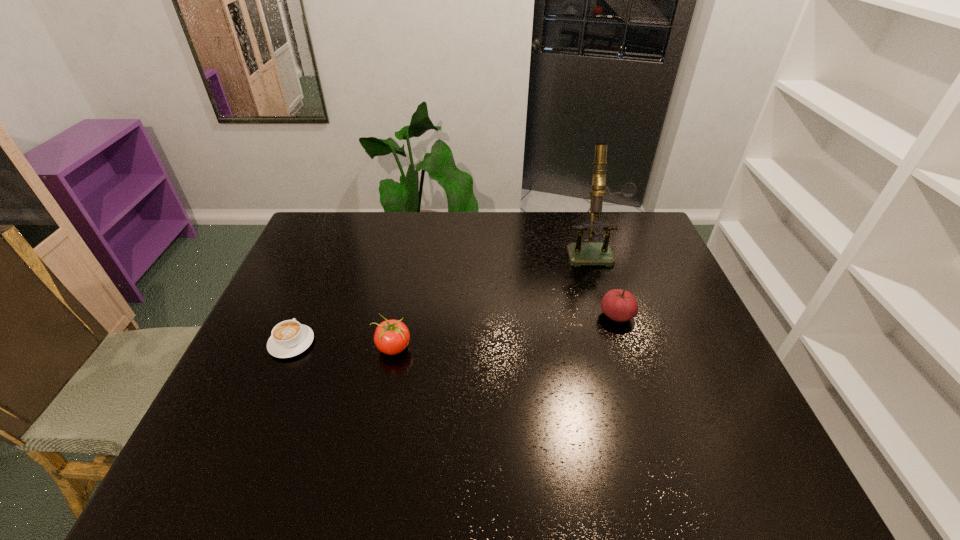
Where is `microscope`? microscope is located at coordinates (579, 253).

Where is `the farthest object`? the farthest object is located at coordinates (579, 253).

Where is `the farther tomato`? the farther tomato is located at coordinates pos(619,305).

In order to click on the second object from left to right in this screenshot , I will do `click(391, 337)`.

In order to click on the nearer tomato in this screenshot , I will do `click(391, 337)`.

Locate an element on the screen. This screenshot has width=960, height=540. the leftmost object is located at coordinates (289, 338).

You are a GUI agent. You are given a task and a screenshot of the screen. Output one action in this format:
    pyautogui.click(x=<x>, y=<y>)
    Task: Click on the cappuccino
    Image resolution: width=960 pixels, height=540 pixels.
    Given the screenshot: What is the action you would take?
    pyautogui.click(x=289, y=338)

Locate an element on the screen. Image resolution: width=960 pixels, height=540 pixels. vacant space located 0.130m at the eyepiece of the tallest object is located at coordinates (607, 294).

This screenshot has height=540, width=960. In order to click on vacant space located 0.050m on the back of the right tomato in this screenshot , I will do `click(609, 292)`.

Locate an element on the screen. This screenshot has height=540, width=960. blank space located 0.180m on the right of the nearer tomato is located at coordinates (478, 348).